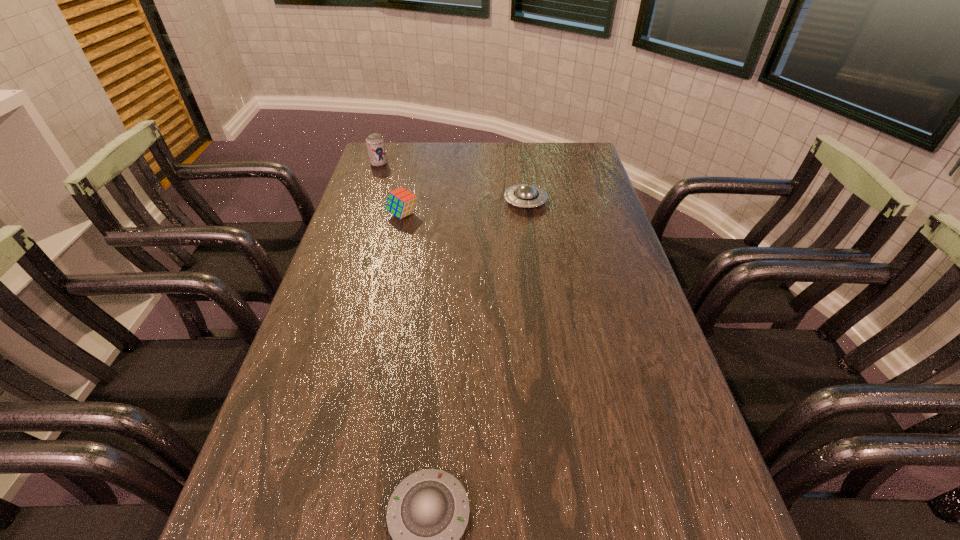
Where is `free location that satisfies the following two spatial constraints: 1. on the back side of the cube; 2. on the right side of the farther saucer`? free location that satisfies the following two spatial constraints: 1. on the back side of the cube; 2. on the right side of the farther saucer is located at coordinates (405, 201).

Where is `free space that satisfies the following two spatial constraints: 1. on the front side of the leftmost object; 2. on the left side of the cube`? Image resolution: width=960 pixels, height=540 pixels. free space that satisfies the following two spatial constraints: 1. on the front side of the leftmost object; 2. on the left side of the cube is located at coordinates (362, 214).